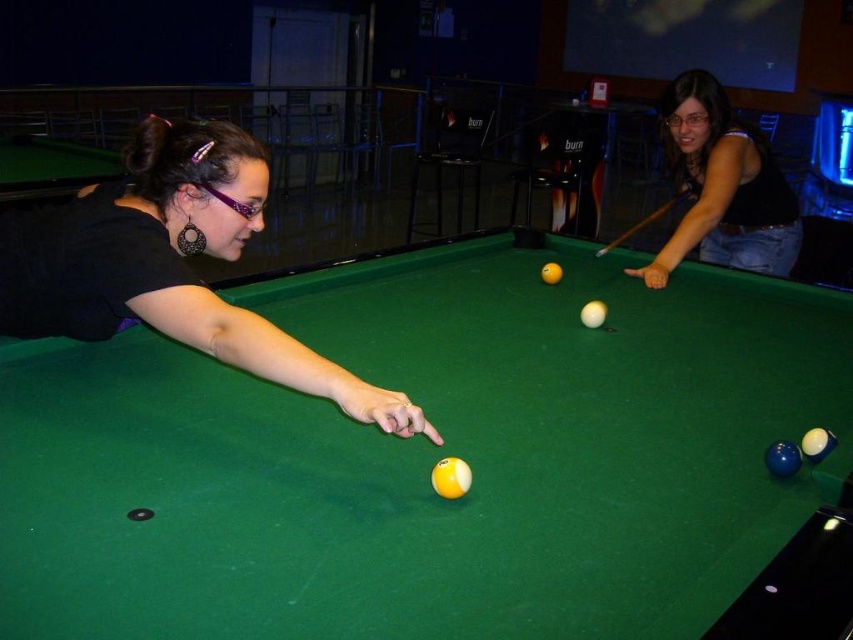
Question: Which point is closer to the camera?

Choices:
 (A) (758, 212)
 (B) (660, 358)

Answer: (B)

Question: Does matte black shirt at left have a smaller size compared to matte black tank top at upper right?

Choices:
 (A) yes
 (B) no

Answer: (A)

Question: Based on their relative distances, which object is nearer to the green felt billiard table at center?

Choices:
 (A) matte black tank top at upper right
 (B) matte black shirt at left

Answer: (B)

Question: In this image, where is green felt billiard table at center located relative to matte black tank top at upper right?

Choices:
 (A) below
 (B) above

Answer: (A)

Question: Is green felt billiard table at center to the right of matte black shirt at left from the viewer's perspective?

Choices:
 (A) yes
 (B) no

Answer: (A)

Question: Which of these objects is positioned closest to the matte black shirt at left?

Choices:
 (A) matte black tank top at upper right
 (B) green felt billiard table at center

Answer: (B)